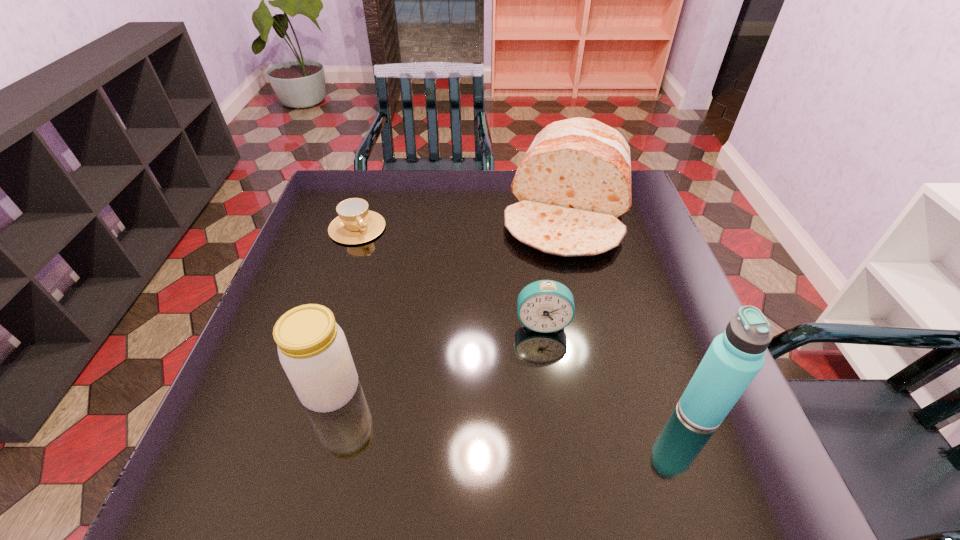
Locate an element on the screen. The width and height of the screenshot is (960, 540). free space between the cup and the fourth tallest object is located at coordinates (450, 275).

Identify the location of vacant space that is in between the bread and the third nearest object. This screenshot has width=960, height=540. (556, 267).

Locate an element on the screen. free spot between the jar and the bread is located at coordinates (450, 301).

Identify which object is located as the second nearest to the bread. Please provide its 2D coordinates. Your answer should be formatted as a tuple, i.e. [(x, y)], where the tuple contains the x and y coordinates of a point satisfying the conditions above.

[(355, 224)]

This screenshot has width=960, height=540. In order to click on the fourth closest object to the second shortest object in this screenshot , I will do `click(355, 224)`.

The image size is (960, 540). Identify the location of vacant space that satisfies the following two spatial constraints: 1. on the front side of the cup; 2. on the left side of the jar. coord(304,390).

This screenshot has width=960, height=540. What are the coordinates of `vacant space that satisfies the following two spatial constraints: 1. on the front side of the cup; 2. on the left side of the tallest object` in the screenshot? It's located at (298, 411).

Where is `vacant space that satisfies the following two spatial constraints: 1. on the front side of the tallest object; 2. on the right side of the cup`? This screenshot has height=540, width=960. vacant space that satisfies the following two spatial constraints: 1. on the front side of the tallest object; 2. on the right side of the cup is located at coordinates (298, 411).

You are a GUI agent. You are given a task and a screenshot of the screen. Output one action in this format:
    pyautogui.click(x=<x>, y=<y>)
    Task: Click on the vacant area that satisfies the following two spatial constraints: 1. on the back side of the third nearest object; 2. on the left side of the jar
    
    Given the screenshot: What is the action you would take?
    pyautogui.click(x=349, y=322)